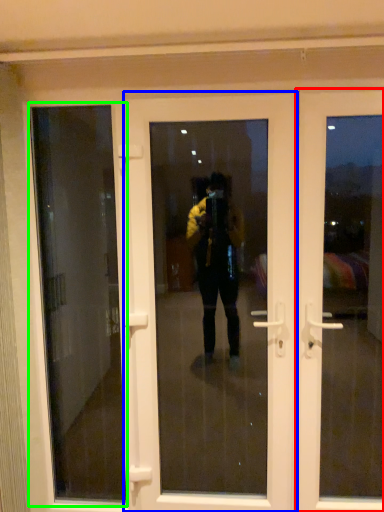
Question: Considering the real-world distances, which object is farthest from door (highlighted by a red box)? door (highlighted by a blue box) or window screen (highlighted by a green box)?

Choices:
 (A) door
 (B) window screen

Answer: (B)